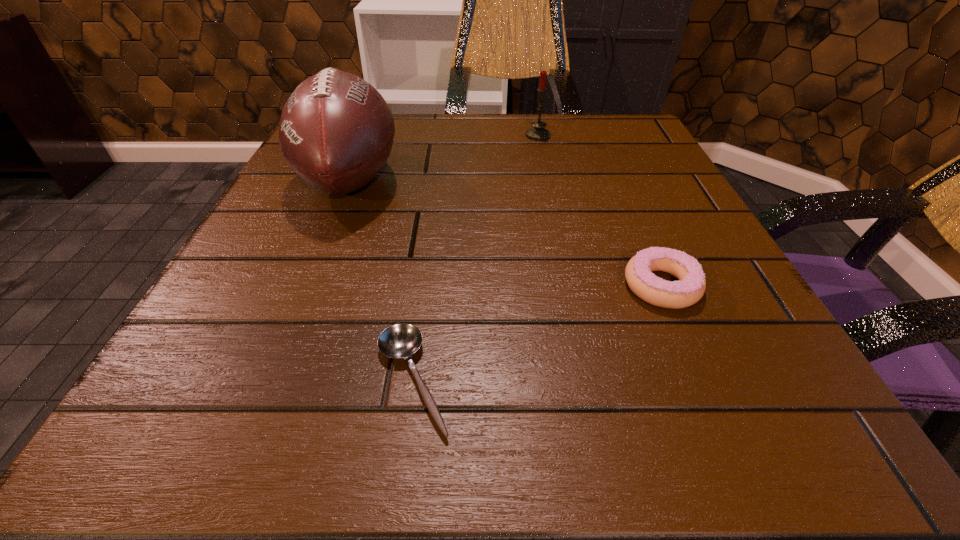
Where is `free spot located on the back of the third farthest object`? The width and height of the screenshot is (960, 540). free spot located on the back of the third farthest object is located at coordinates (600, 143).

Where is `free region located 0.310m on the right of the nearest object`? The image size is (960, 540). free region located 0.310m on the right of the nearest object is located at coordinates (727, 381).

Locate an element on the screen. The width and height of the screenshot is (960, 540). football (American) situated at the far edge is located at coordinates (336, 131).

Identify the location of candle that is positioned at the far edge. (538, 133).

The width and height of the screenshot is (960, 540). I want to click on object present at the near edge, so click(401, 340).

Where is `object that is at the left edge`? This screenshot has width=960, height=540. object that is at the left edge is located at coordinates (336, 131).

Where is `object located at the right edge`? object located at the right edge is located at coordinates (689, 289).

You are a GUI agent. You are given a task and a screenshot of the screen. Output one action in this format:
    pyautogui.click(x=<x>, y=<y>)
    Task: Click on the object that is at the far left corner
    This screenshot has width=960, height=540.
    Given the screenshot: What is the action you would take?
    pyautogui.click(x=336, y=131)

The width and height of the screenshot is (960, 540). Find the location of `free space at the far edge of the desktop`. free space at the far edge of the desktop is located at coordinates (448, 164).

In the image, there is a desktop. Where is `free space at the near edge`? This screenshot has height=540, width=960. free space at the near edge is located at coordinates (371, 450).